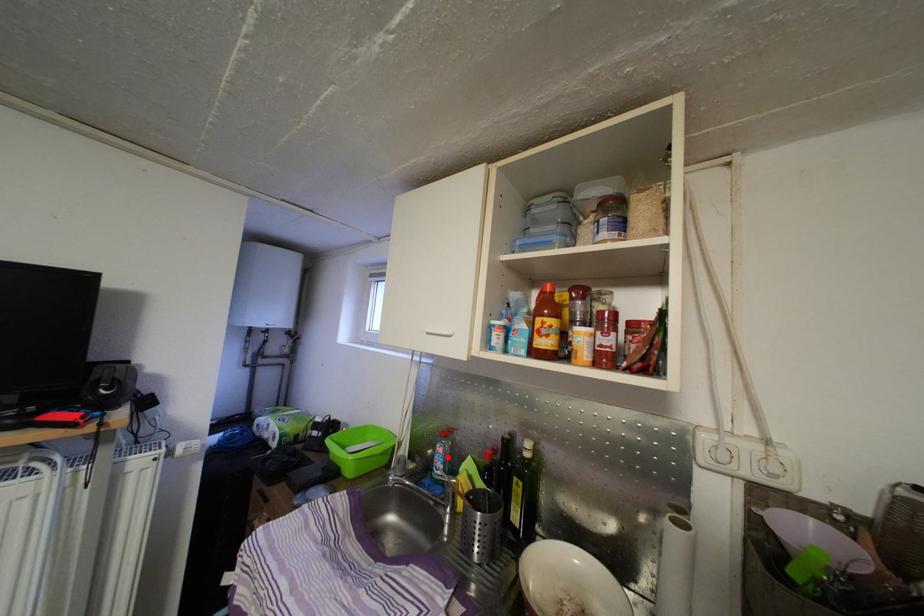
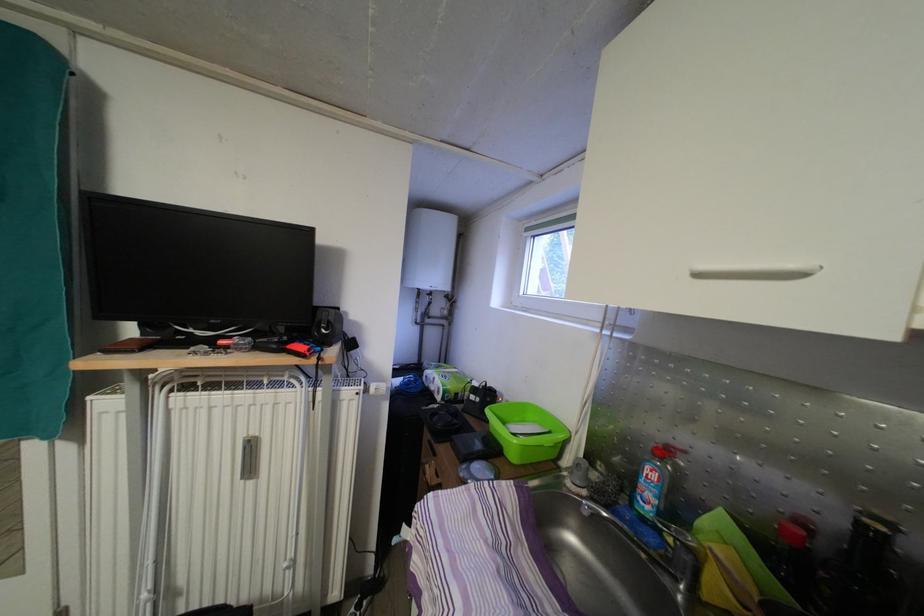
Find the pixel in the second image that matches the highlighted location in the first image.

(661, 484)